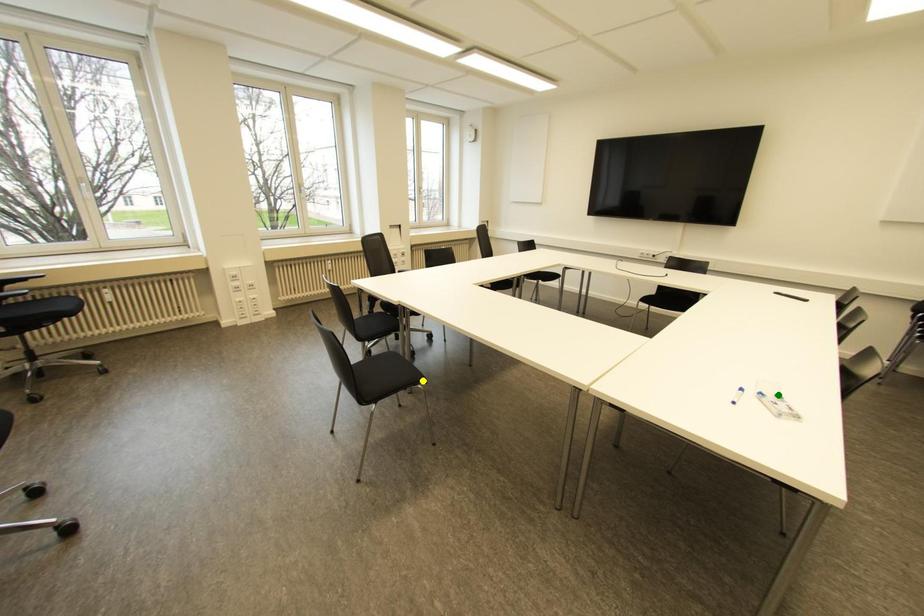
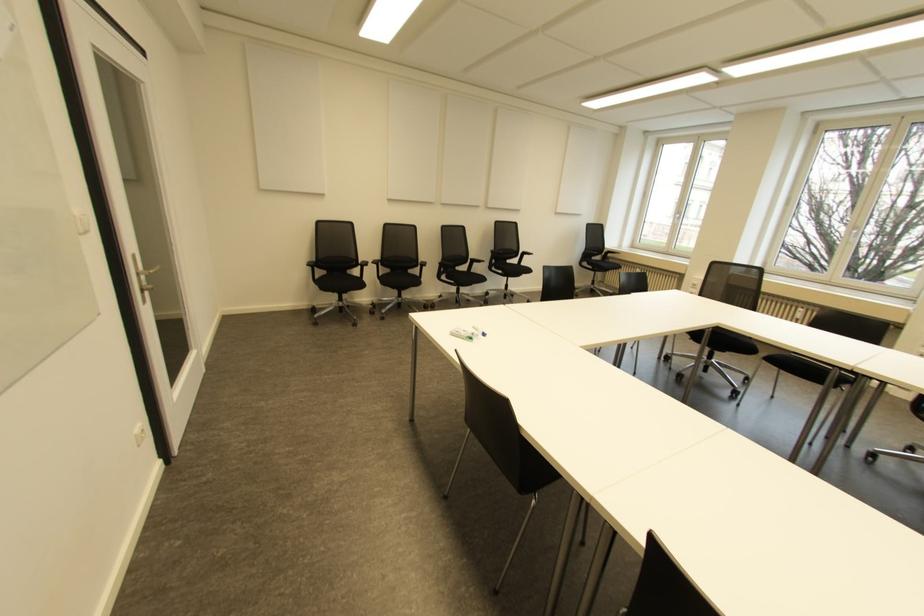
I am providing you with two images of the same scene from different viewpoints. Three points are marked in image1. Which point corresponds to a part or object that is occluded in image2?In image1, three points are marked. Which of them correspond to a part or object that is occluded in image2?Among the three points shown in image1, which one corresponds to a part or object that is no longer visible due to occlusion in image2?

yellow point cannot be seen in image2.